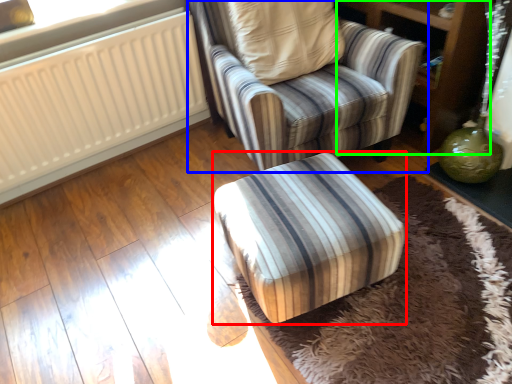
Question: Which is farther away from furniture (highlighted by a red box)? chair (highlighted by a blue box) or dresser (highlighted by a green box)?

Choices:
 (A) chair
 (B) dresser

Answer: (B)